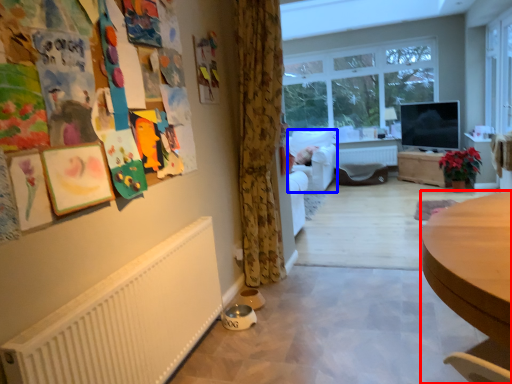
Question: Which object is further to the camera taking this photo, desk (highlighted by a red box) or armchair (highlighted by a blue box)?

Choices:
 (A) desk
 (B) armchair

Answer: (B)